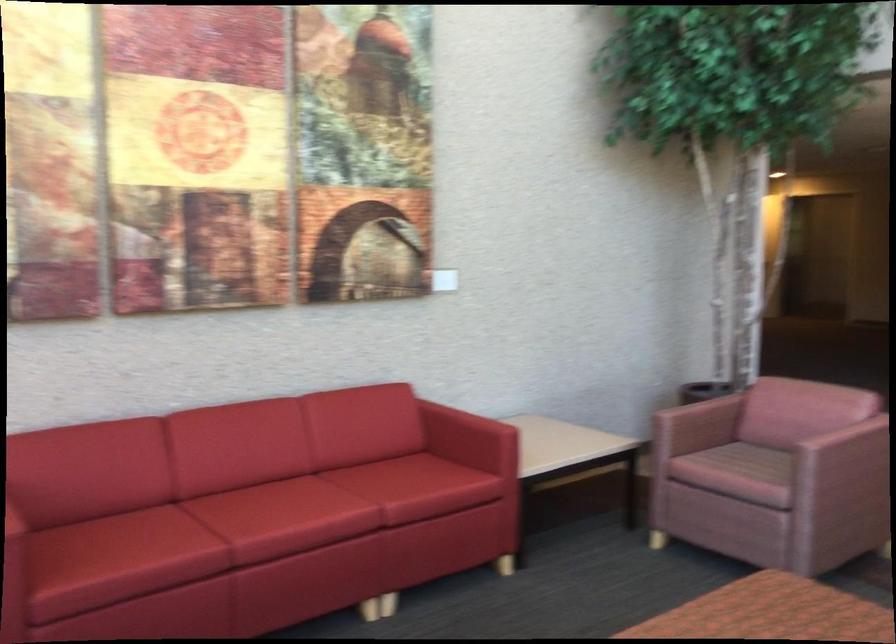
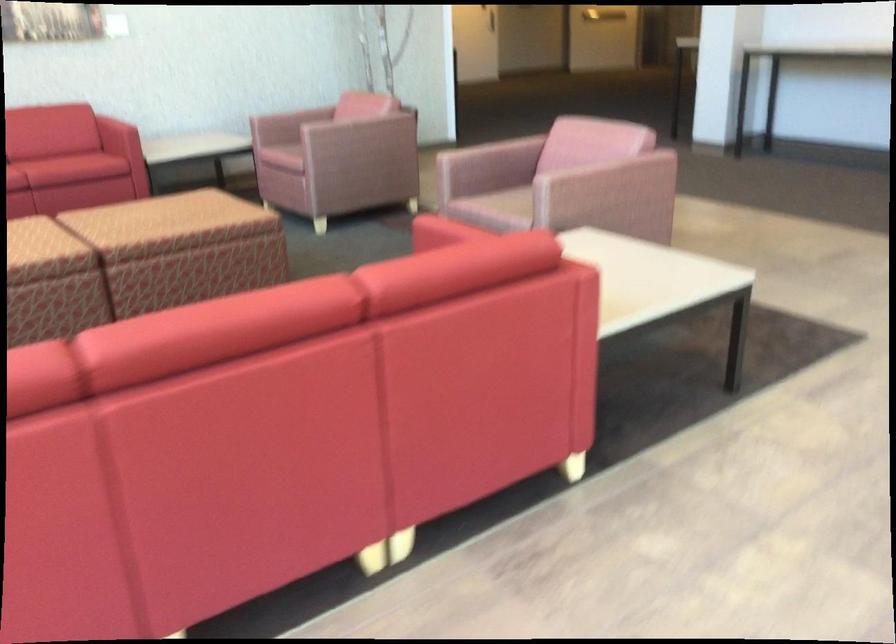
In a continuous first-person perspective shot, in which direction is the camera moving?

→ The movement direction of the cameraman is right, backward.